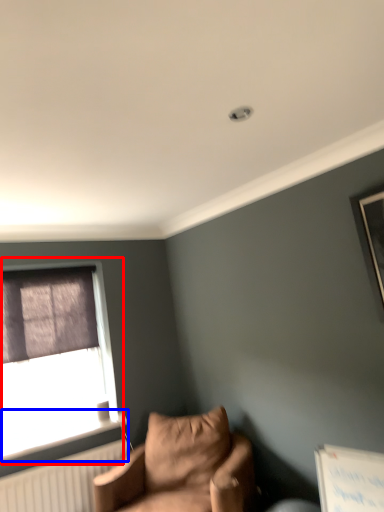
Question: Which of the following is the farthest to the observer, window (highlighted by a red box) or window sill (highlighted by a blue box)?

Choices:
 (A) window
 (B) window sill

Answer: (A)